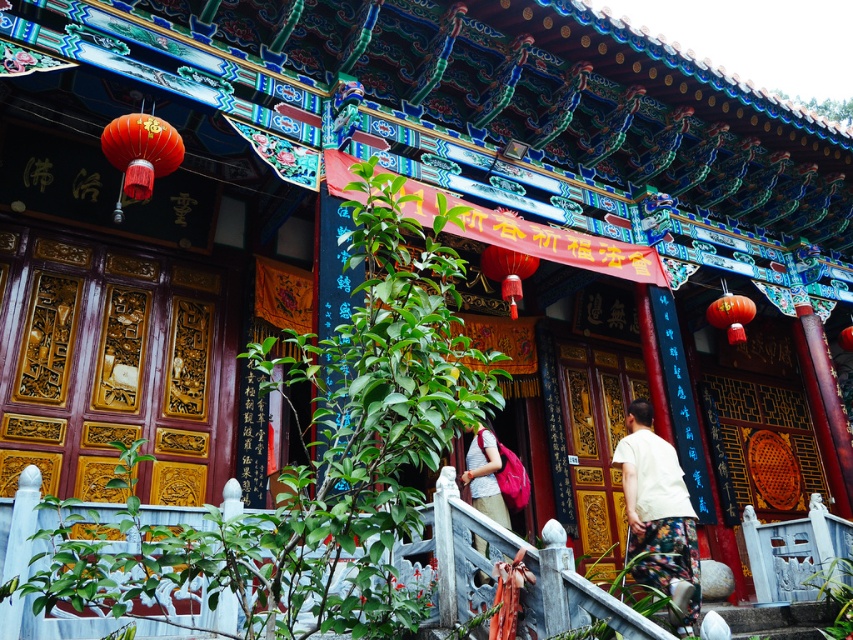
Between white cotton shirt at center and matte pink backpack at center, which one is positioned lower?

matte pink backpack at center is lower down.

Does point (654, 461) lie in front of point (459, 476)?

Yes, point (654, 461) is in front of point (459, 476).

Does point (639, 556) come in front of point (473, 458)?

Yes, point (639, 556) is closer to viewer.

Find the location of a particular element. Image resolution: width=853 pixels, height=640 pixels. white cotton shirt at center is located at coordinates (659, 520).

Who is positioned more to the right, light yellow t-shirt at lower right or white cotton shirt at center?

white cotton shirt at center is more to the right.

The height and width of the screenshot is (640, 853). I want to click on light yellow t-shirt at lower right, so click(x=659, y=515).

Where is `light yellow t-shirt at lower right`? The image size is (853, 640). light yellow t-shirt at lower right is located at coordinates (659, 515).

Between point (648, 548) and point (492, 504), which one is positioned in front?

Point (648, 548) is more forward.

Does point (695, 576) come behind point (474, 483)?

No, it is not.

Find the location of `light yellow t-shirt at lower right`. light yellow t-shirt at lower right is located at coordinates (659, 515).